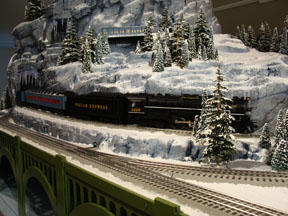
You are a GUI agent. You are given a task and a screenshot of the screen. Output one action in this format:
    pyautogui.click(x=<x>, y=<y>)
    Task: Click on the lights
    
    Given the screenshot: What is the action you would take?
    pyautogui.click(x=114, y=32), pyautogui.click(x=122, y=33), pyautogui.click(x=135, y=31), pyautogui.click(x=141, y=30)